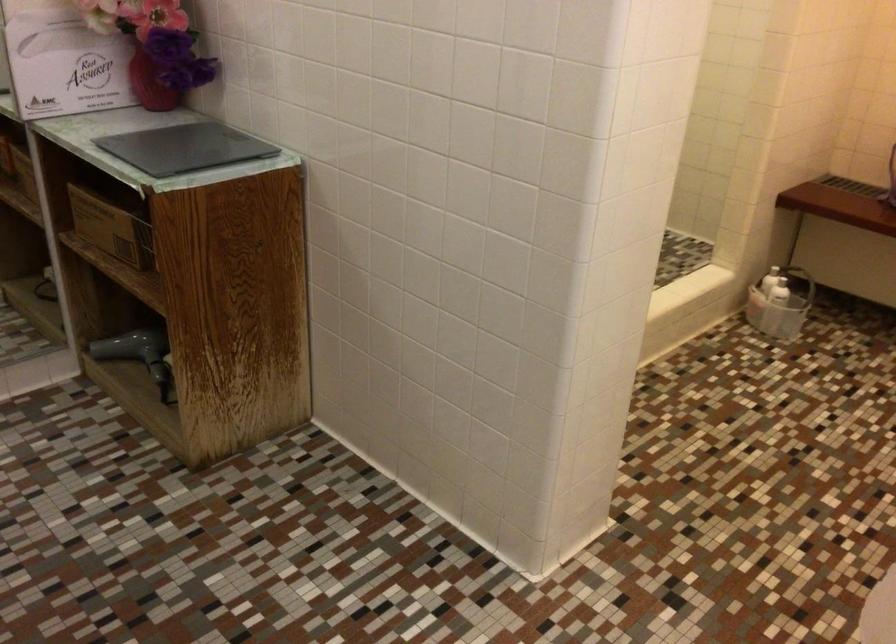
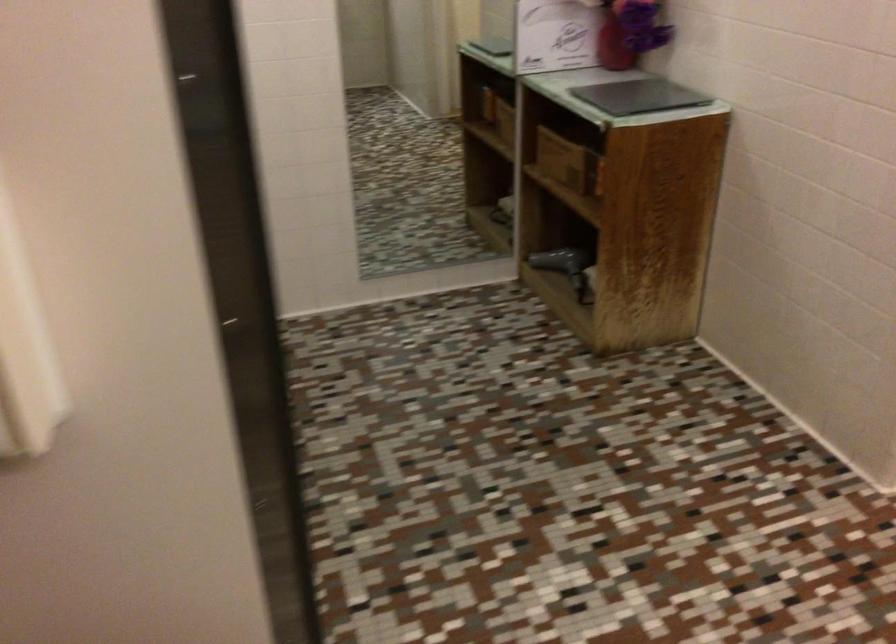
Find the pixel in the second image that matches point 200,140 in the first image.

(639, 96)